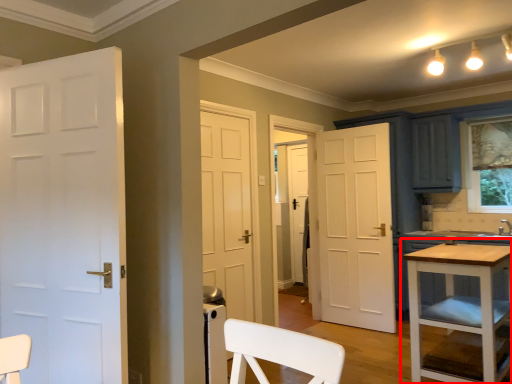
Question: From the image's perspective, considering the relative positions of table (annotated by the red box) and door in the image provided, where is table (annotated by the red box) located with respect to the staircase?

Choices:
 (A) above
 (B) below

Answer: (B)